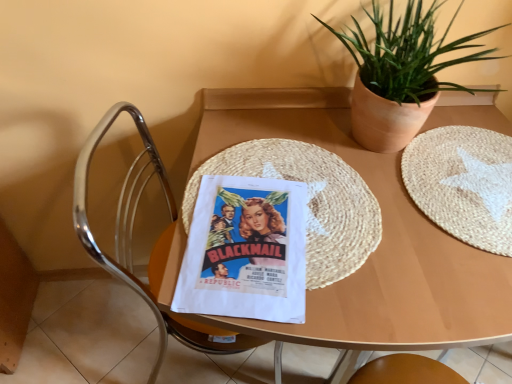
You are a GUI agent. You are given a task and a screenshot of the screen. Output one action in this format:
    pyautogui.click(x=<x>, y=<y>)
    Task: Click on the free location to the right of matte paper poster at center
    
    Given the screenshot: What is the action you would take?
    pyautogui.click(x=373, y=251)